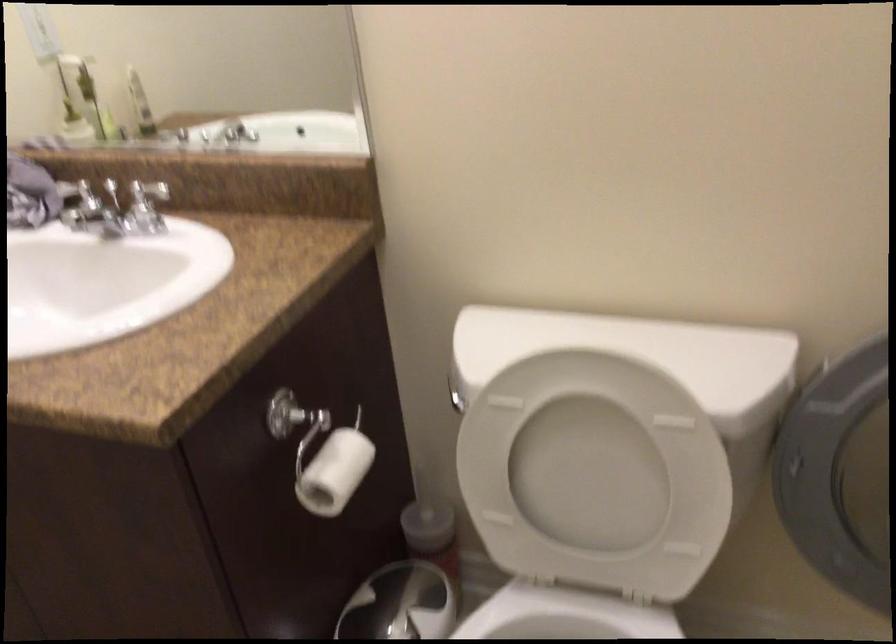
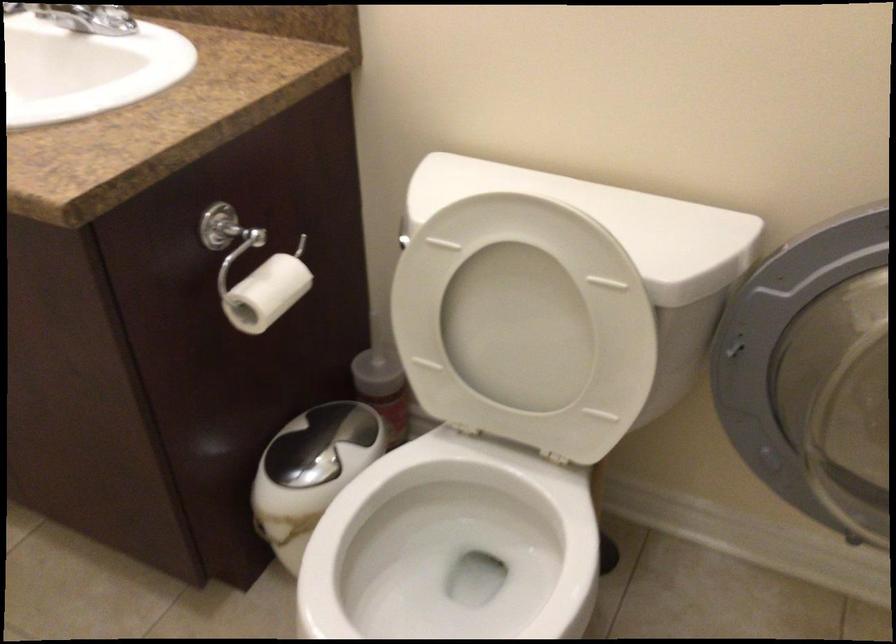
In the second image, find the point that corresponds to (332,462) in the first image.

(263, 286)